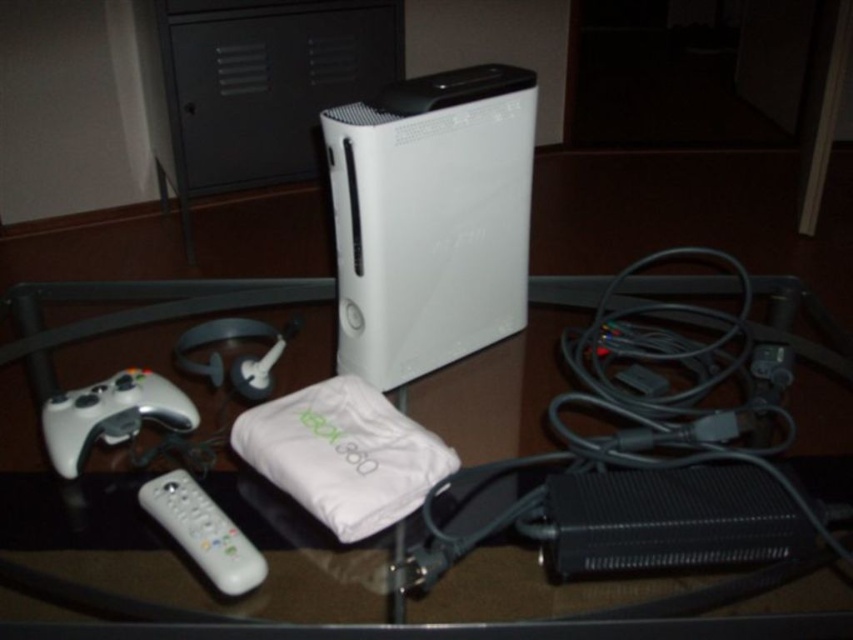
Question: Which point is farther to the camera?

Choices:
 (A) (122, 426)
 (B) (402, 97)
 (C) (42, 352)

Answer: (C)

Question: Which object is positioned farthest from the transparent glass table at center?

Choices:
 (A) white plastic remote at lower left
 (B) white matte game controller at lower left
 (C) white matte wii at center

Answer: (A)

Question: Is white matte wii at center bigger than white matte game controller at lower left?

Choices:
 (A) no
 (B) yes

Answer: (B)

Question: Which object is positioned farthest from the white matte game controller at lower left?

Choices:
 (A) white plastic remote at lower left
 (B) transparent glass table at center

Answer: (B)

Question: Does white matte wii at center have a larger size compared to transparent glass table at center?

Choices:
 (A) no
 (B) yes

Answer: (A)

Question: Can you confirm if white matte wii at center is wider than white matte game controller at lower left?

Choices:
 (A) yes
 (B) no

Answer: (A)